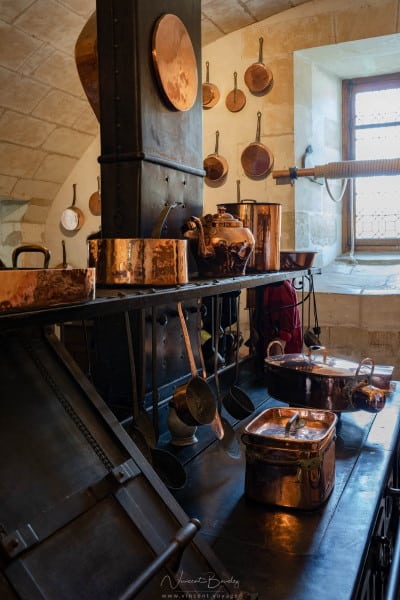
Find the location of a particular element. This screenshot has width=400, height=600. teapot is located at coordinates (238, 246).